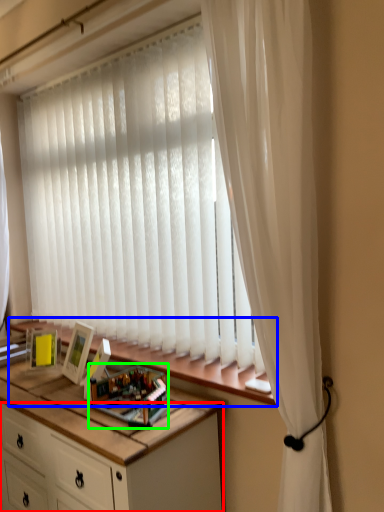
Question: Which is farther away from cabinetry (highlighted by a red box)? window sill (highlighted by a blue box) or toy (highlighted by a green box)?

Choices:
 (A) window sill
 (B) toy

Answer: (A)